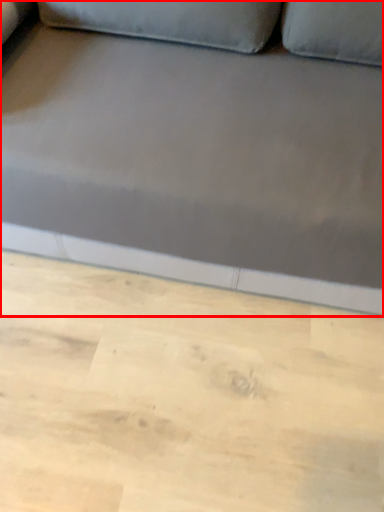
Question: Considering the relative positions of studio couch (annotated by the red box) and plywood in the image provided, where is studio couch (annotated by the red box) located with respect to the staircase?

Choices:
 (A) right
 (B) left

Answer: (A)